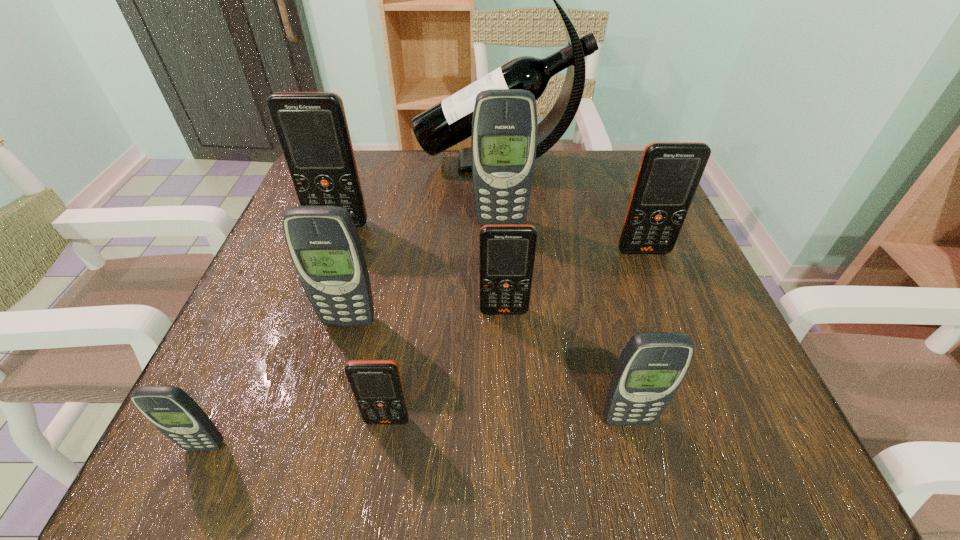
You are a GUI agent. You are given a task and a screenshot of the screen. Output one action in this format:
    pyautogui.click(x=<x>, y=<y>)
    Task: Click on the second cellular telephone from right to left
    
    Given the screenshot: What is the action you would take?
    pyautogui.click(x=652, y=366)

Where is `the second smallest gray cellular telephone`? Image resolution: width=960 pixels, height=540 pixels. the second smallest gray cellular telephone is located at coordinates (652, 366).

At what (x,y) coordinates should I click in order to perform the action: click on the fifth nearest cellular telephone. Please return your answer as a coordinate pair (x, y). Looking at the image, I should click on (507, 252).

Locate an element on the screen. the fifth nearest object is located at coordinates (507, 252).

The height and width of the screenshot is (540, 960). What are the coordinates of `the nearest orange cellular telephone` in the screenshot? It's located at (376, 384).

Identify the location of the smallest orange cellular telephone. (376, 384).

What are the coordinates of `the nearest object` in the screenshot? It's located at (173, 412).

Locate an element on the screen. the nearest cellular telephone is located at coordinates (173, 412).

Find the location of a particular element. blank space located 0.080m on the stand of the wine bottle is located at coordinates (383, 163).

This screenshot has height=540, width=960. What are the coordinates of `vacant area located 0.130m on the stand of the wine bottle` in the screenshot? It's located at (363, 163).